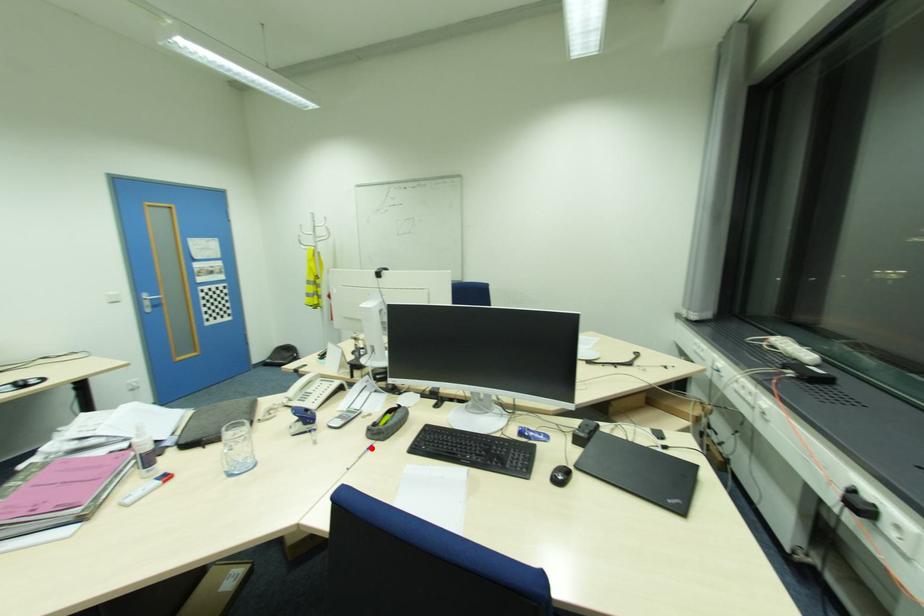
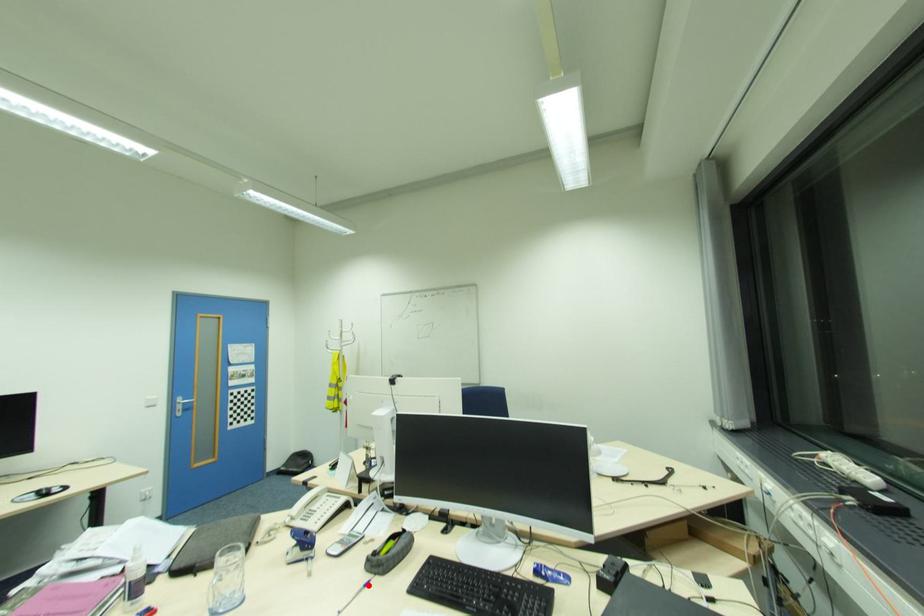
I am providing you with two images of the same scene from different viewpoints. A red point is marked on the first image and another point is marked on the second image. Is the marked point in image1 the same physical position as the marked point in image2?

Yes